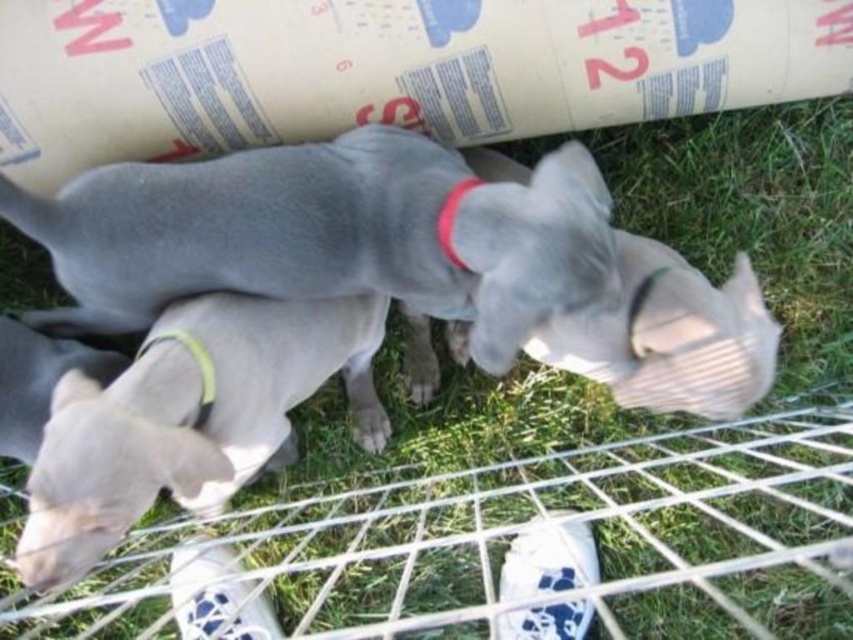
Question: Which object is the farthest from the red fabric neckband at center?

Choices:
 (A) yellow fabric neckband at lower center
 (B) smooth gray dog at lower left
 (C) smooth gray dog at center

Answer: (B)

Question: Which of these objects is positioned farthest from the red fabric neckband at center?

Choices:
 (A) smooth gray dog at center
 (B) yellow fabric neckband at lower center

Answer: (B)

Question: Is smooth gray dog at center above red fabric neckband at center?

Choices:
 (A) yes
 (B) no

Answer: (B)

Question: Which point is closer to the camera?

Choices:
 (A) smooth gray dog at lower left
 (B) red fabric neckband at center

Answer: (A)

Question: In this image, where is smooth gray dog at lower left located relative to red fabric neckband at center?

Choices:
 (A) right
 (B) left

Answer: (B)

Question: Does smooth gray dog at center appear on the right side of red fabric neckband at center?

Choices:
 (A) no
 (B) yes

Answer: (A)